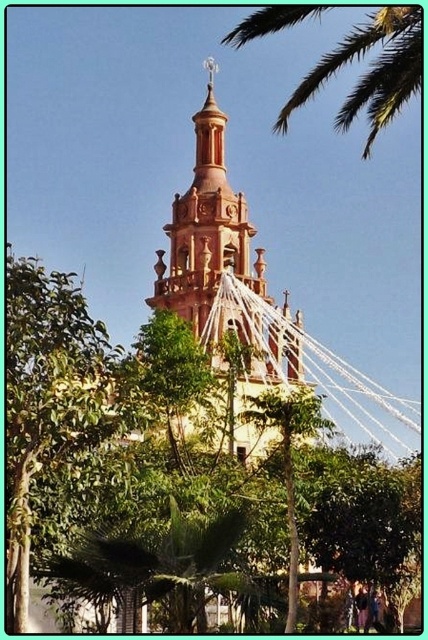
You are standing in front of the church and want to take a photo of both the green leafy tree at center and the terracotta stucco church tower at center. Which one should you focus on first to ensure both are in frame?

The green leafy tree at center is below the terracotta stucco church tower at center, so focus on the terracotta stucco church tower at center first to ensure both are in frame.

You are standing in front of the terracotta stucco church tower at center and want to take a photo that includes both it and the green leafy palm at upper right. Since the palm is shorter than the tower, will the palm fit entirely in the photo if you frame the tower first?

The terracotta stucco church tower at center is taller than the green leafy palm at upper right. Therefore, if you frame the tower first, the palm will fit entirely in the photo since it is shorter.